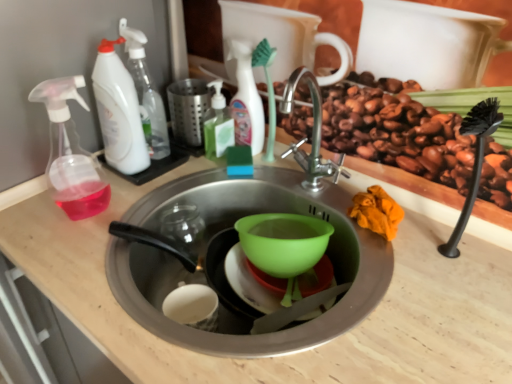
Locate an element on the screen. vacant space to the right of white plastic spray bottle at upper left, placed as the 3th cleaning product when sorted from right to left is located at coordinates (207, 162).